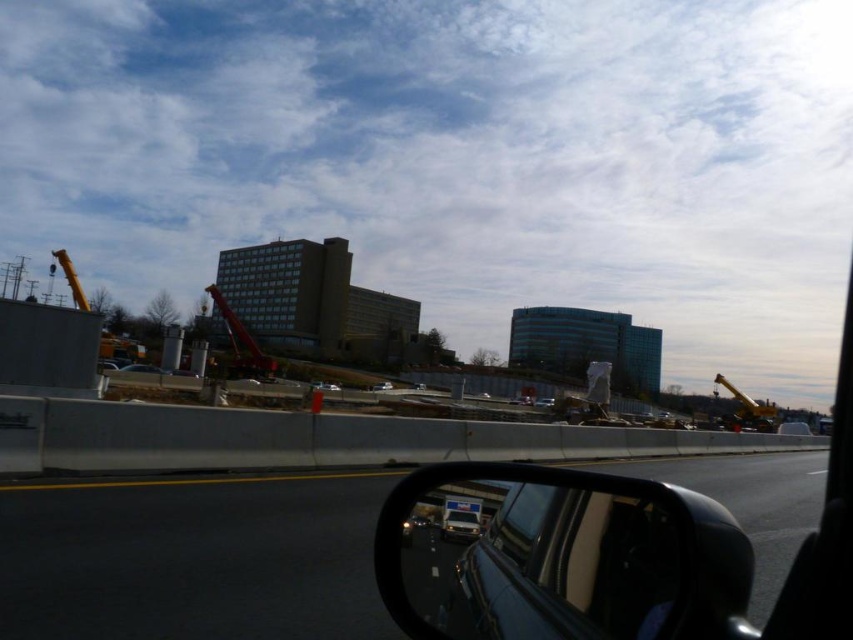
You are a passenger in the car and looking out the window. You see the metallic red crane at center and the yellow metallic crane at right. Which crane is positioned closer to the left side of your view?

The metallic red crane at center is positioned to the left of the yellow metallic crane at right, so it is closer to the left side of your view.